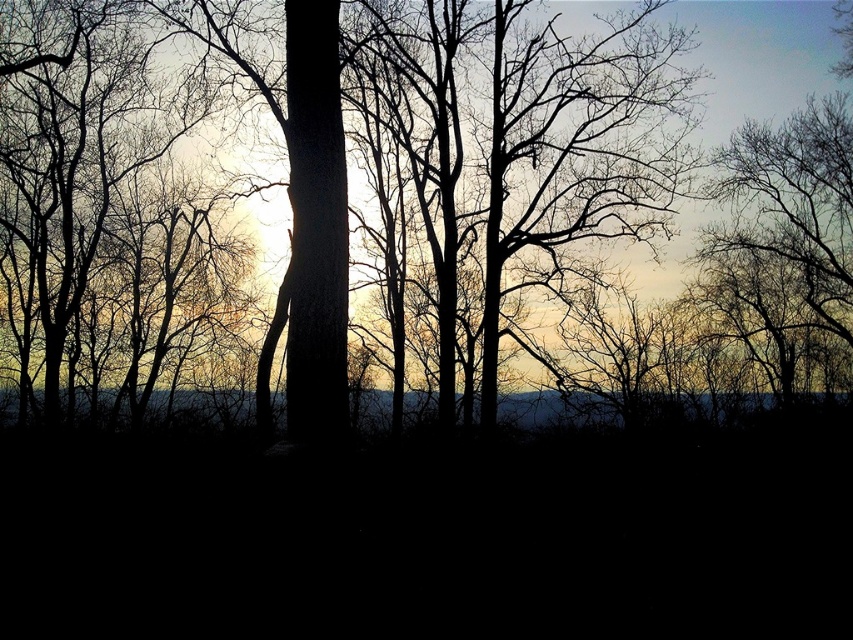
You are an artist trying to paint the forest scene. You want to place the smooth bark tree at center and the silhouette bark tree at center correctly. According to the scene, which tree should be positioned to the left?

The smooth bark tree at center should be positioned to the left of the silhouette bark tree at center.

You are an artist trying to paint the forest scene. You have two trees in front of you, the smooth bark tree at center and the silhouette bark tree at center. Which tree should you paint larger to accurately represent their sizes as seen in the image?

The smooth bark tree at center is bigger than the silhouette bark tree at center, so you should paint the smooth bark tree at center larger to accurately represent their sizes as seen in the image.

You are navigating through a forest and need to locate the smooth bark tree at center. According to the coordinates provided, where exactly is this tree positioned?

The smooth bark tree at center is located at point (398,179), so it is positioned at those coordinates in the image.